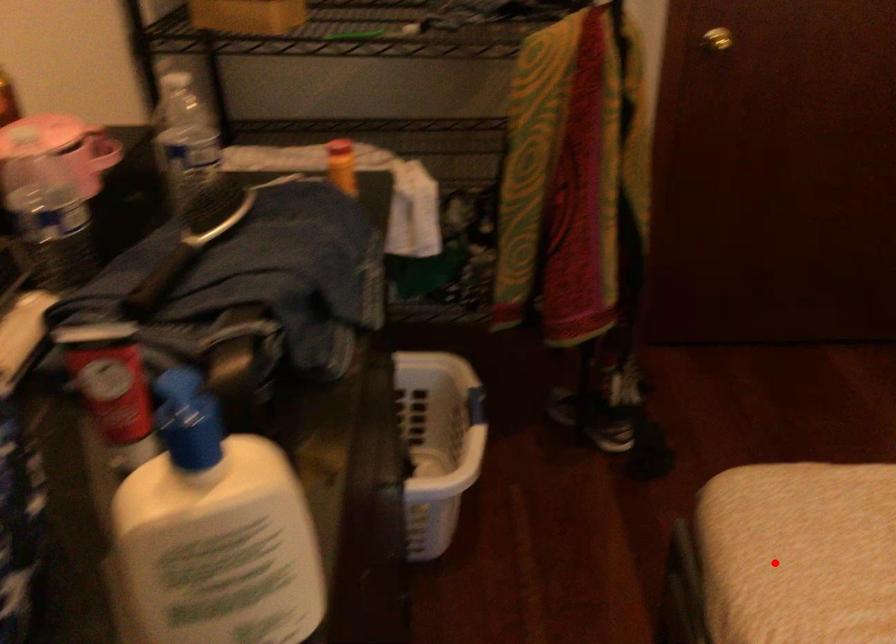
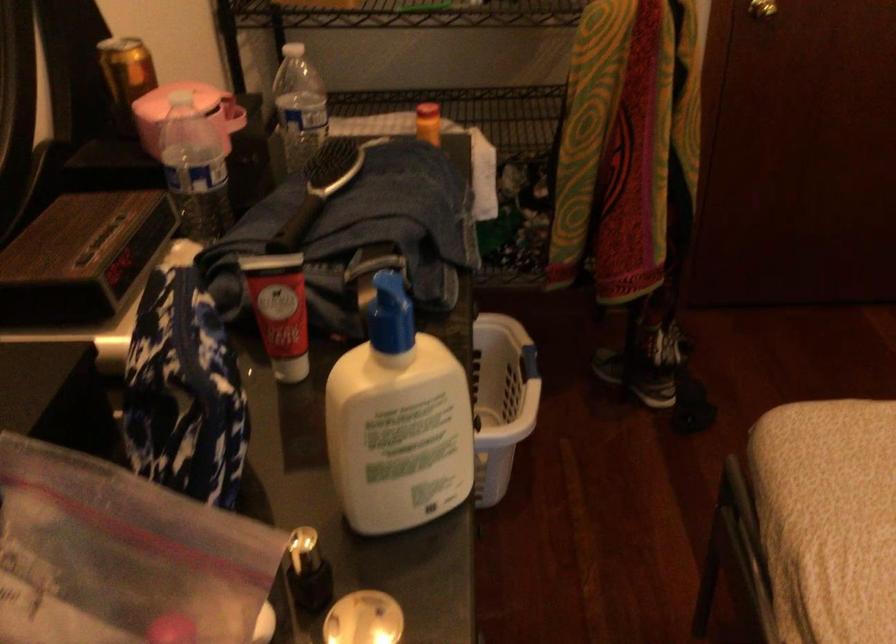
Find the pixel in the second image that matches the highlighted location in the first image.

(828, 488)